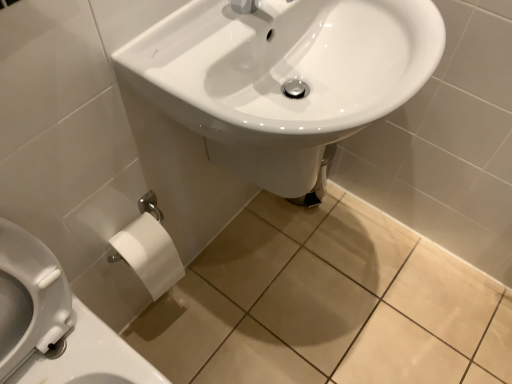
The height and width of the screenshot is (384, 512). I want to click on white glossy sink at center, so click(283, 77).

What is the approximate width of white glossy sink at center?

It is 17.24 inches.

At what (x,y) coordinates should I click in order to perform the action: click on white glossy sink at center. Please return your answer as a coordinate pair (x, y). This screenshot has height=384, width=512. Looking at the image, I should click on (283, 77).

Considering the relative positions of white glossy sink at center and white matte toilet paper at lower left in the image provided, is white glossy sink at center behind white matte toilet paper at lower left?

No, it is not.

Does white glossy sink at center contain white matte toilet paper at lower left?

No.

Does white glossy sink at center have a lesser height compared to white matte toilet paper at lower left?

No.

The height and width of the screenshot is (384, 512). In order to click on toilet paper below the white paper at lower left (from a real-world perspective) in this screenshot , I will do `click(150, 254)`.

Consider the image. From the image's perspective, is white paper at lower left located above or below white matte toilet paper at lower left?

From the image's perspective, white paper at lower left appears below white matte toilet paper at lower left.

Visually, is white paper at lower left positioned to the left or to the right of white matte toilet paper at lower left?

In the image, white paper at lower left appears on the left side of white matte toilet paper at lower left.

This screenshot has height=384, width=512. I want to click on toilet on the left of white matte toilet paper at lower left, so click(55, 324).

Considering the relative positions of white matte toilet paper at lower left and white paper at lower left in the image provided, is white matte toilet paper at lower left to the right of white paper at lower left from the viewer's perspective?

Indeed, white matte toilet paper at lower left is positioned on the right side of white paper at lower left.

What's the angular difference between white matte toilet paper at lower left and white paper at lower left's facing directions?

0.224 degrees.

Considering the positions of objects white matte toilet paper at lower left and white paper at lower left in the image provided, who is in front, white matte toilet paper at lower left or white paper at lower left?

Positioned in front is white paper at lower left.

Is point (129, 259) closer to camera compared to point (364, 96)?

No, (129, 259) is further to viewer.

In terms of height, does white matte toilet paper at lower left look taller or shorter compared to white glossy sink at center?

In the image, white matte toilet paper at lower left appears to be shorter than white glossy sink at center.

Looking at this image, between white matte toilet paper at lower left and white glossy sink at center, which one has smaller size?

white matte toilet paper at lower left.

From a real-world perspective, is white matte toilet paper at lower left on top of white glossy sink at center?

No, from a real-world perspective, white matte toilet paper at lower left is not on top of white glossy sink at center.

Locate an element on the screen. toilet in front of the white glossy sink at center is located at coordinates tap(55, 324).

Which of these two, white glossy sink at center or white paper at lower left, is thinner?

With smaller width is white glossy sink at center.

Does point (284, 147) come in front of point (140, 370)?

Yes, point (284, 147) is closer to viewer.

Does white paper at lower left have a greater width compared to white glossy sink at center?

Yes.

Which is more to the right, white paper at lower left or white glossy sink at center?

white glossy sink at center is more to the right.

Is white paper at lower left inside the boundaries of white glossy sink at center, or outside?

white paper at lower left is spatially situated outside white glossy sink at center.

Between point (45, 260) and point (317, 119), which one is positioned in front?

The point (45, 260) is in front.

You are a GUI agent. You are given a task and a screenshot of the screen. Output one action in this format:
    pyautogui.click(x=<x>, y=<y>)
    Task: Click on the sink to the right of white matte toilet paper at lower left
    The width and height of the screenshot is (512, 384).
    Given the screenshot: What is the action you would take?
    pyautogui.click(x=283, y=77)

Identify the location of toilet above the white matte toilet paper at lower left (from a real-world perspective). Image resolution: width=512 pixels, height=384 pixels. (55, 324).

From the picture: Looking at the image, which one is located closer to white matte toilet paper at lower left, white glossy sink at center or white paper at lower left?

Among the two, white paper at lower left is located nearer to white matte toilet paper at lower left.

When comparing their distances from white paper at lower left, does white glossy sink at center or white matte toilet paper at lower left seem closer?

white matte toilet paper at lower left is positioned closer to the anchor white paper at lower left.

Estimate the real-world distances between objects in this image. Which object is closer to white matte toilet paper at lower left, white paper at lower left or white glossy sink at center?

Among the two, white paper at lower left is located nearer to white matte toilet paper at lower left.

Based on their spatial positions, is white paper at lower left or white matte toilet paper at lower left further from white glossy sink at center?

white paper at lower left.

Estimate the real-world distances between objects in this image. Which object is further from white paper at lower left, white matte toilet paper at lower left or white glossy sink at center?

white glossy sink at center.

Considering their positions, is white matte toilet paper at lower left positioned closer to white glossy sink at center than white paper at lower left?

white matte toilet paper at lower left.

This screenshot has width=512, height=384. I want to click on sink located between white paper at lower left and white matte toilet paper at lower left in the depth direction, so click(283, 77).